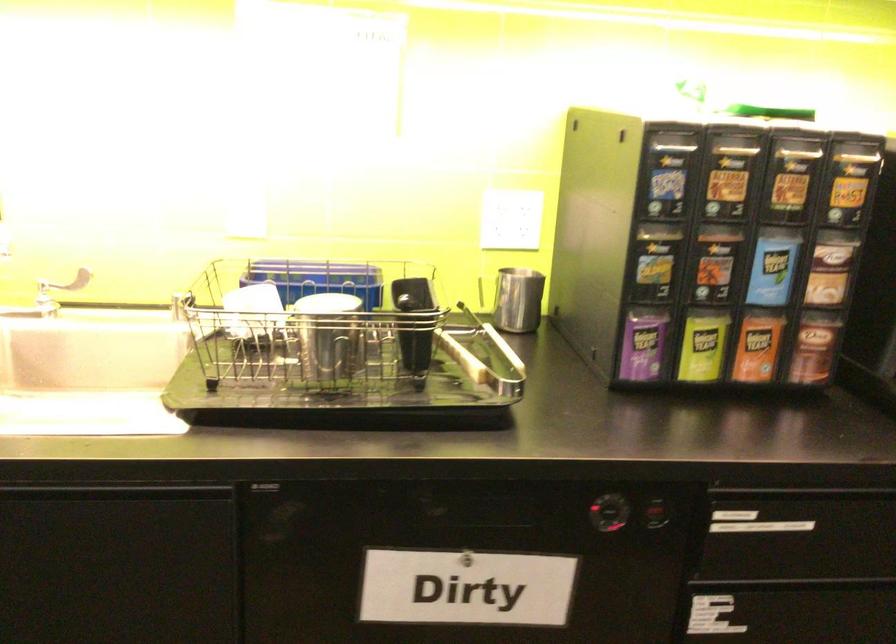
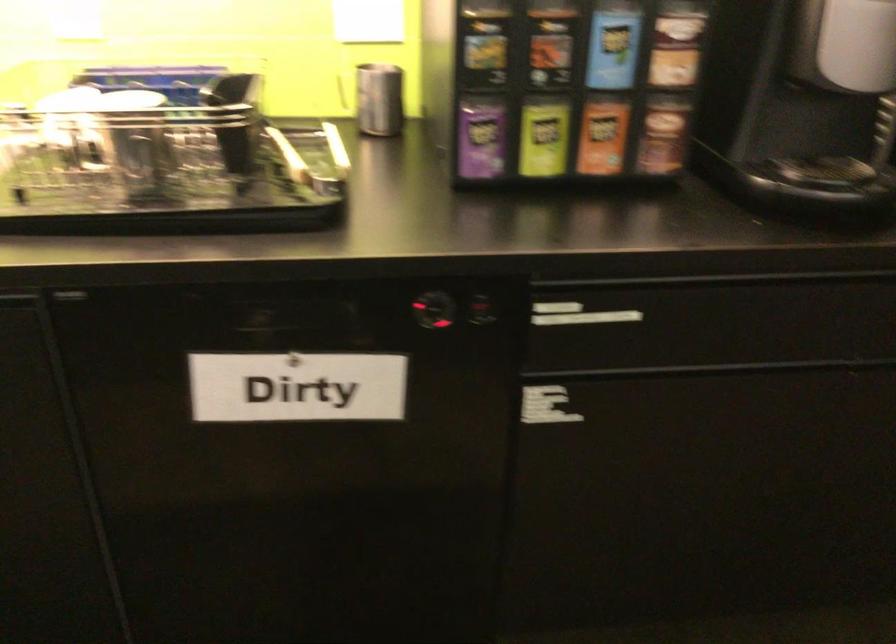
Question: I am providing you with two images of the same scene from different viewpoints. After the viewpoint changes to image2, which objects are now occluded?

Choices:
 (A) dishwasher control dial
 (B) black drawer handle
 (C) orange tea box
 (D) none of these

Answer: (D)